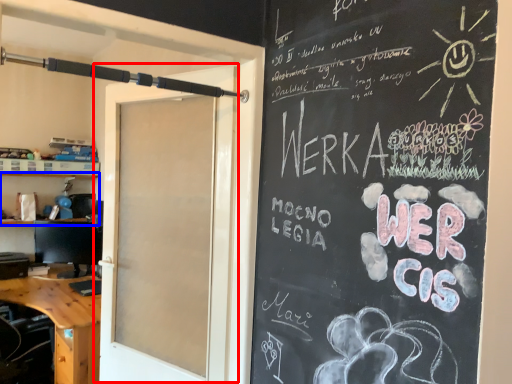
Question: Which of the following is the closest to the observer, door (highlighted by a red box) or shelf (highlighted by a blue box)?

Choices:
 (A) door
 (B) shelf

Answer: (A)